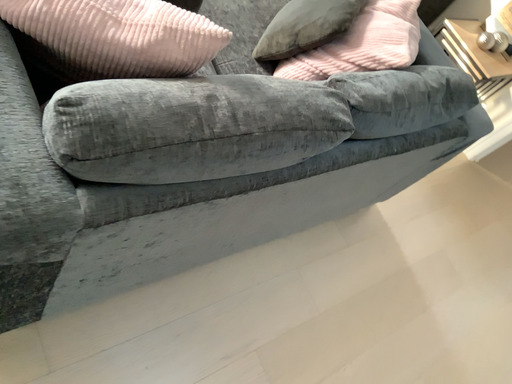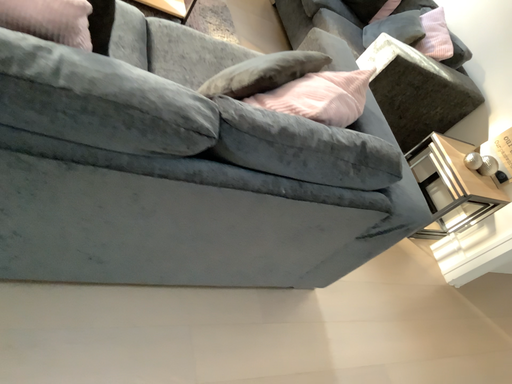
Question: Which way did the camera rotate in the video?

Choices:
 (A) rotated downward
 (B) rotated upward

Answer: (B)